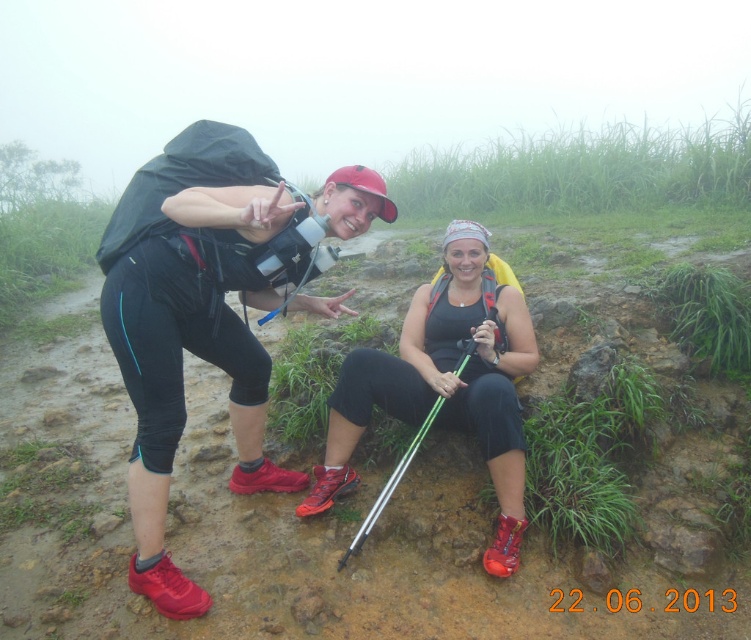
You are a hiker who needs to locate your backpack and tank top in your photo. According to the scene, where is the matte black backpack at left in relation to the matte black tank top at center?

The matte black backpack at left is located below the matte black tank top at center.